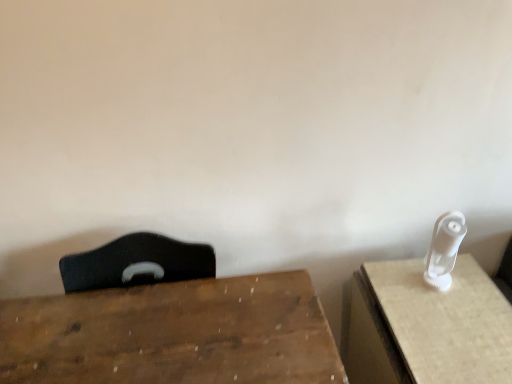
Find the location of a particular element. The width and height of the screenshot is (512, 384). free space in front of white plastic wii controller at right is located at coordinates (454, 331).